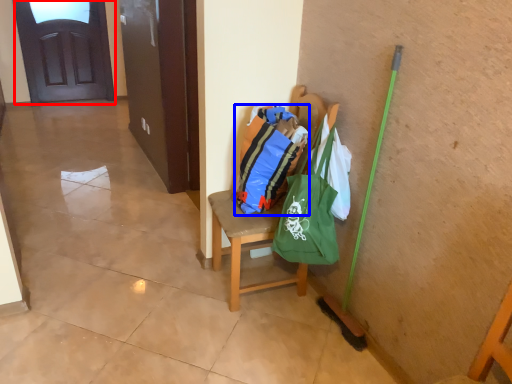
Question: Which object appears farthest to the camera in this image, door (highlighted by a red box) or shopping bag (highlighted by a blue box)?

Choices:
 (A) door
 (B) shopping bag

Answer: (A)